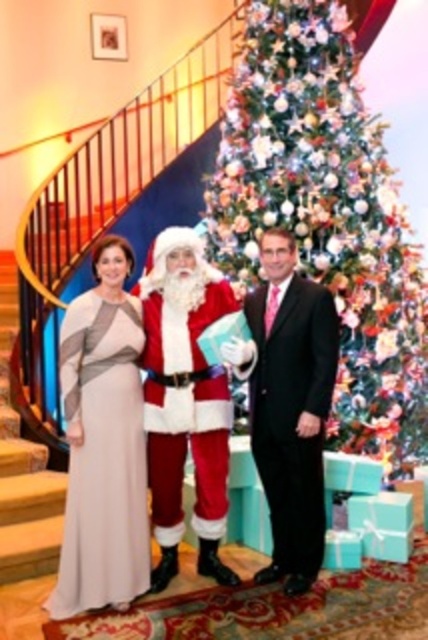
You are taking a photo of two points in the scene. The first point is at coordinate point (x=71, y=397) and the second is at point (x=311, y=314). Which point is closer to the camera?

Point (x=71, y=397) is closer to the camera than point (x=311, y=314).

You are a photographer at a holiday party and need to arrange two guests for a photo. The guests are wearing the silky white dress at center and the satin beige dress at left. According to the scene, which dress is positioned to the right of the other?

The silky white dress at center is positioned to the right of the satin beige dress at left.